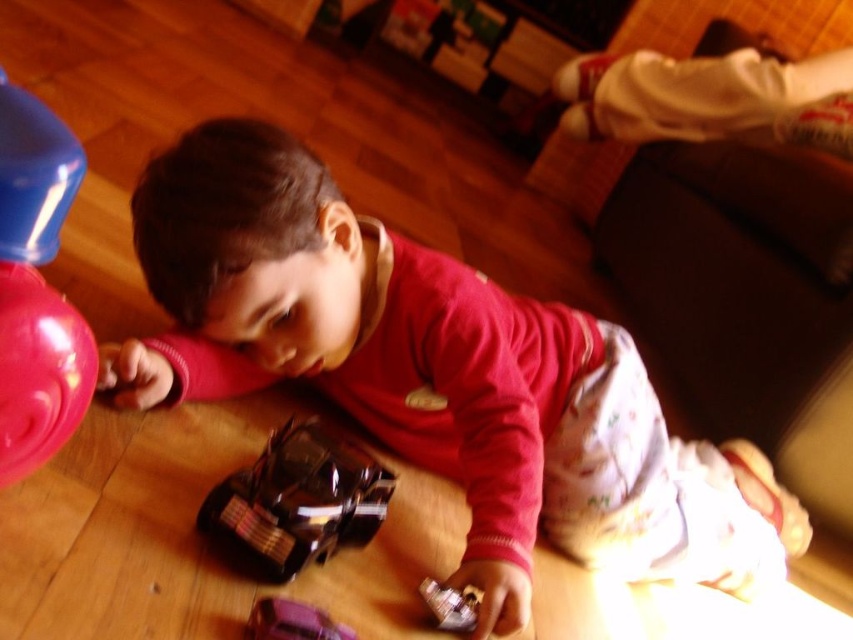
You are a photographer taking a picture of the scene. You notice two points in the image labeled as point 1 and point 2. If point 1 is at coordinate point (12, 145) and point 2 is at coordinate point (347, 634), which point will appear larger in your photo?

Point 1 will appear larger in the photo because it is closer to the camera than point 2.

You are a parent trying to clean up toys. You see the rubberized pink ball at left and the metallic purple car at lower center. If you want to place them together in a storage bin, will they fit if the bin can hold items up to 40 centimeters apart?

The rubberized pink ball at left and the metallic purple car at lower center are 39.79 centimeters apart, so they will fit in the bin since the distance between them is less than 40 centimeters.

You are a parent trying to retrieve the rubberized pink ball at left for your child. You are currently holding a 24 inch long wooden spoon. Can you safely reach the ball without moving your current position?

The distance between the rubberized pink ball at left and the camera is 26.67 inches. Since the wooden spoon is only 24 inches long, you cannot safely reach the ball without moving closer.